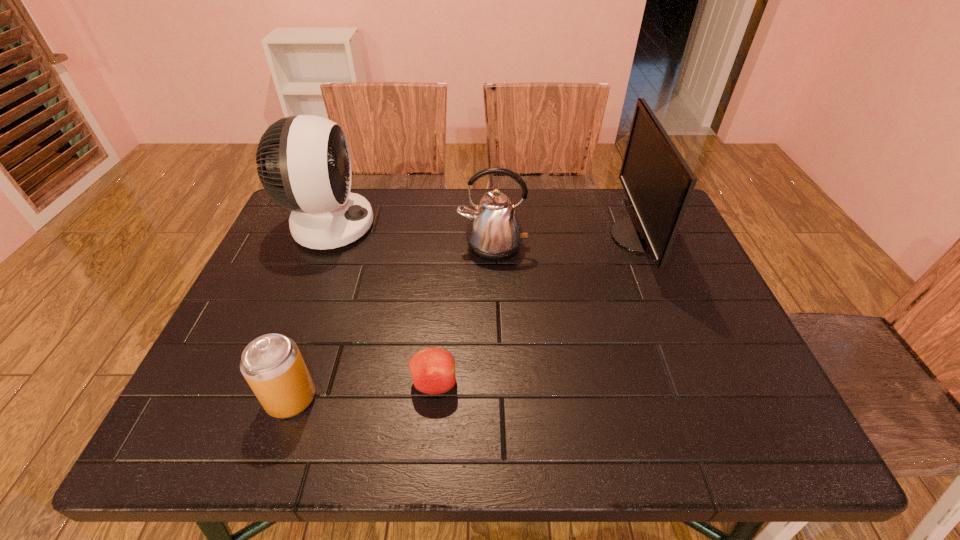
Image resolution: width=960 pixels, height=540 pixels. Identify the location of object that is at the near left corner. (272, 365).

The height and width of the screenshot is (540, 960). What are the coordinates of `object present at the far right corner` in the screenshot? It's located at (658, 183).

This screenshot has width=960, height=540. In the image, there is a desktop. Find the location of `free region at the far edge`. free region at the far edge is located at coordinates (540, 199).

The image size is (960, 540). Identify the location of vacant space at the near edge of the desktop. (617, 425).

Where is `vacant space at the left edge of the desktop`? vacant space at the left edge of the desktop is located at coordinates (298, 269).

This screenshot has width=960, height=540. Find the location of `vacant region at the right edge of the desktop`. vacant region at the right edge of the desktop is located at coordinates (665, 310).

The height and width of the screenshot is (540, 960). In the image, there is a desktop. Find the location of `vacant space at the far left corner`. vacant space at the far left corner is located at coordinates (287, 231).

Find the location of a particular element. The image size is (960, 540). vacant space at the near right corner is located at coordinates [760, 453].

Identify the location of unoccupied area between the shortest object and the monitor. (537, 310).

The image size is (960, 540). I want to click on vacant area between the fourth tallest object and the monitor, so click(x=465, y=318).